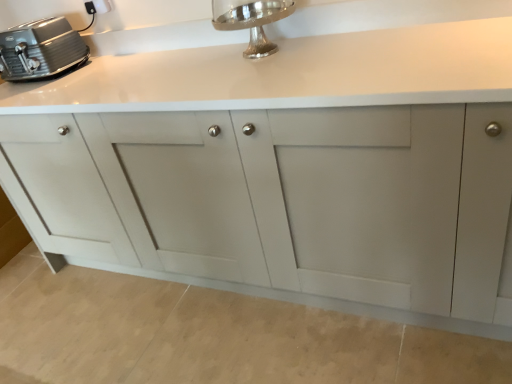
Question: In the image, is matte gray cabinet at center positioned in front of or behind white plastic electric outlet at upper left?

Choices:
 (A) behind
 (B) front

Answer: (B)

Question: Is point (385, 140) closer or farther from the camera than point (92, 3)?

Choices:
 (A) farther
 (B) closer

Answer: (B)

Question: Which is farther from the matte gray cabinet at center?

Choices:
 (A) white plastic electric outlet at upper left
 (B) satin silver toaster at upper left
 (C) silver polished faucet at upper center

Answer: (A)

Question: Which of these objects is positioned farthest from the satin silver toaster at upper left?

Choices:
 (A) matte gray cabinet at center
 (B) white plastic electric outlet at upper left
 (C) silver polished faucet at upper center

Answer: (C)